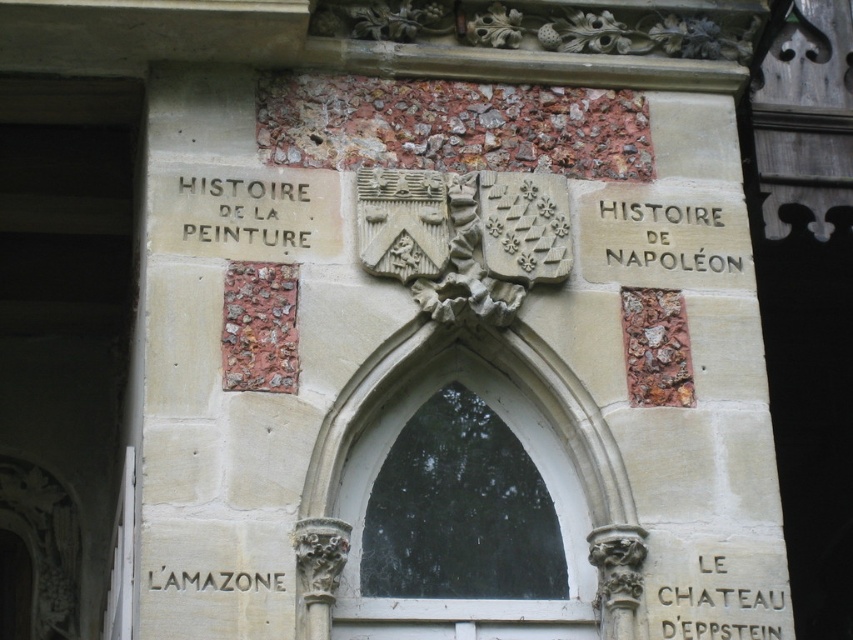
You are standing in front of the architectural detail and want to take a closer look at the stone plaque at center. Given that you can walk up to 10 meters, can you reach it?

The stone plaque at center is 54.90 meters away from camera, so you cannot reach it within your walking limit of 10 meters.